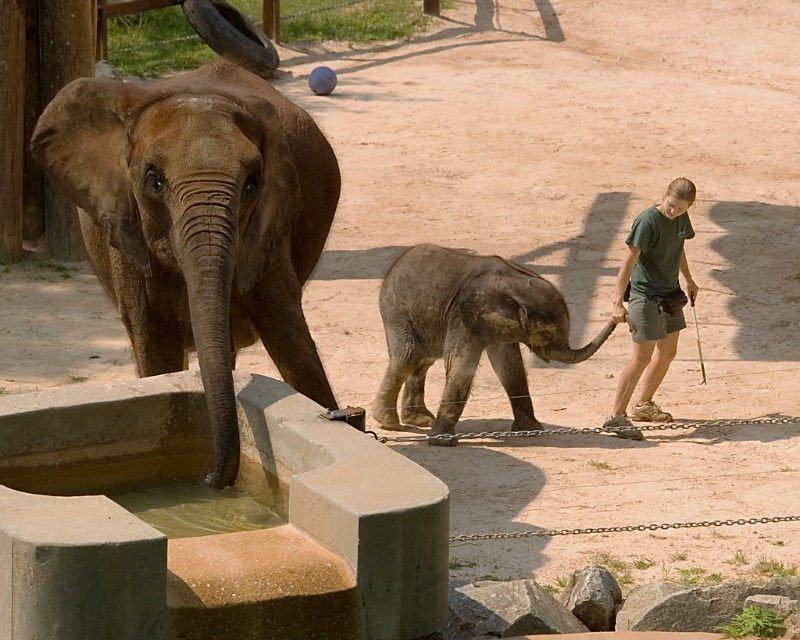
You are a zookeeper trying to locate the baby elephant in the enclosure. You have a map with coordinates. The coordinates point to a specific location. Which animal is at the coordinates point (466, 332)?

The coordinates point (466, 332) correspond to the gray textured baby elephant at center.

You are a zookeeper trying to separate the brown textured elephant at left and the gray textured baby elephant at center for a routine checkup. The minimum safe distance required between them during this process is 2 meters. Based on their current positions, can you safely perform the checkup without moving them?

The brown textured elephant at left is 2.15 meters away from the gray textured baby elephant at center. Since the minimum safe distance required is 2 meters, the current distance of 2.15 meters meets the requirement. Therefore, you can safely perform the checkup without moving them.